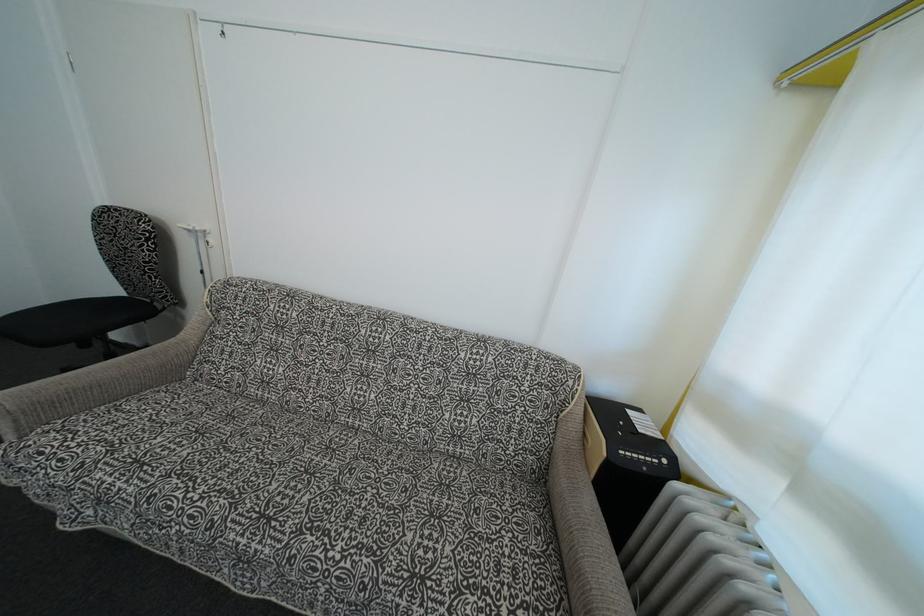
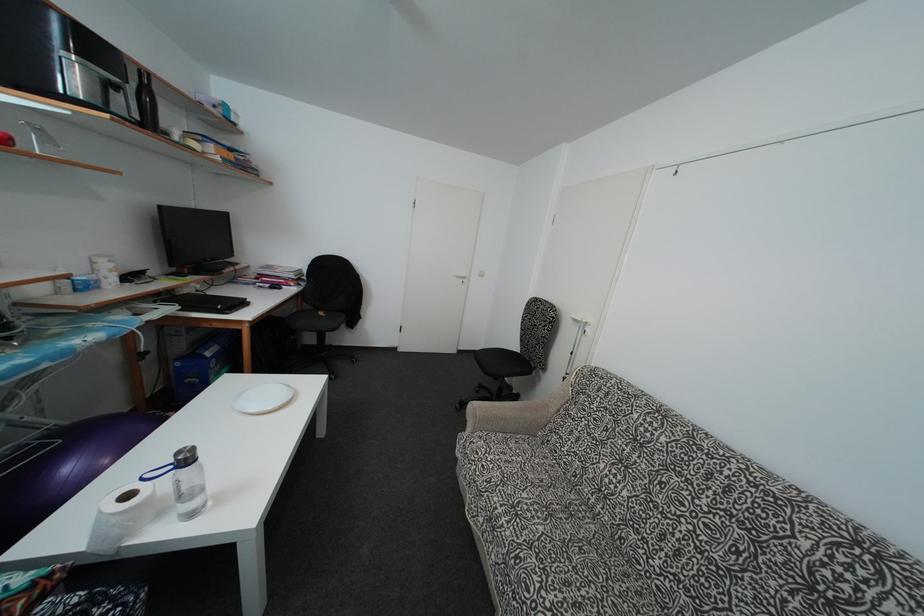
Question: The images are taken continuously from a first-person perspective. In which direction is your viewpoint rotating?

Choices:
 (A) Left
 (B) Right
 (C) Up
 (D) Down

Answer: (A)